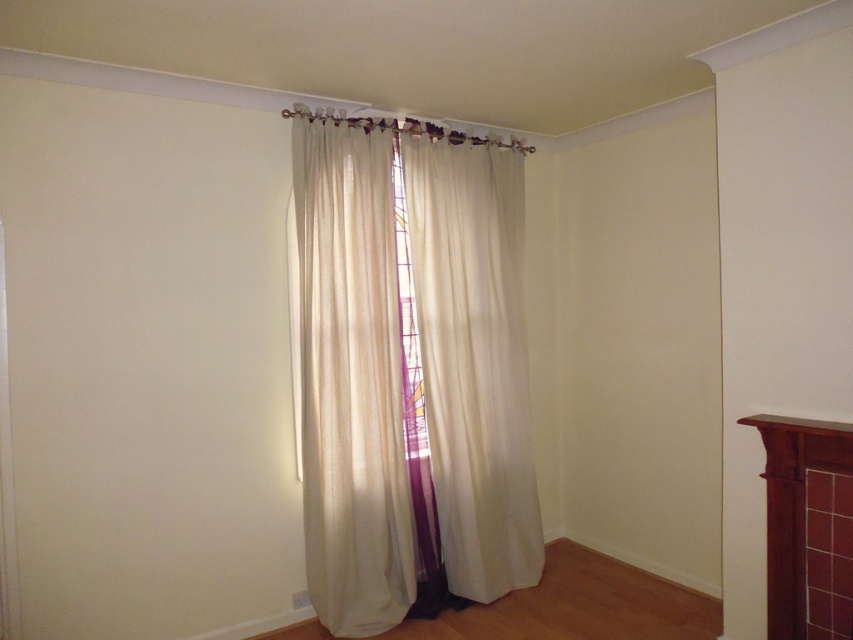
Question: Can you confirm if sheer white curtain at center is bigger than brown wood fireplace at right?

Choices:
 (A) yes
 (B) no

Answer: (A)

Question: Which object is the closest to the transparent glass window at center?

Choices:
 (A) sheer white curtain at center
 (B) brown wood fireplace at right

Answer: (A)

Question: Among these points, which one is farthest from the camera?

Choices:
 (A) (447, 406)
 (B) (421, 412)

Answer: (B)

Question: Is brown wood fireplace at right positioned in front of transparent glass window at center?

Choices:
 (A) no
 (B) yes

Answer: (B)

Question: Does brown wood fireplace at right appear over transparent glass window at center?

Choices:
 (A) no
 (B) yes

Answer: (A)

Question: Which point appears farthest from the camera in this image?

Choices:
 (A) (407, 305)
 (B) (314, 257)

Answer: (A)